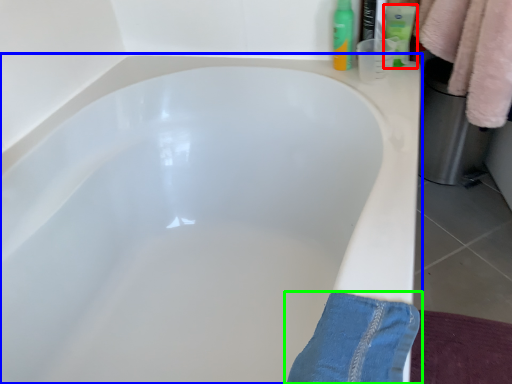
Question: Which object is positioned closest to toiletry (highlighted by a red box)? Select from bathtub (highlighted by a blue box) and trousers (highlighted by a green box).

Choices:
 (A) bathtub
 (B) trousers

Answer: (A)